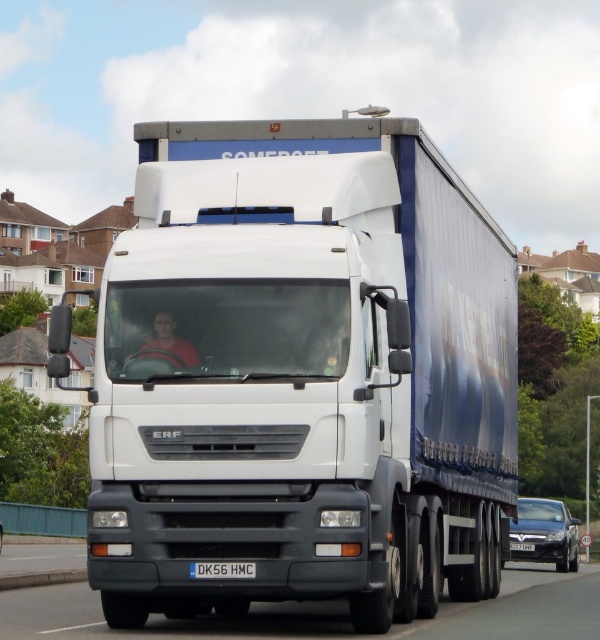
Who is positioned more to the right, white matte truck at center or black plastic license plate at center?

Positioned to the right is white matte truck at center.

What do you see at coordinates (303, 376) in the screenshot?
I see `white matte truck at center` at bounding box center [303, 376].

I want to click on white matte truck at center, so click(303, 376).

Where is `white matte truck at center`? The width and height of the screenshot is (600, 640). white matte truck at center is located at coordinates (303, 376).

Does white matte truck at center appear under white plastic license plate at center?

No.

Does white matte truck at center have a larger size compared to white plastic license plate at center?

Correct, white matte truck at center is larger in size than white plastic license plate at center.

Is point (322, 544) behind point (525, 547)?

No, it is in front of (525, 547).

The width and height of the screenshot is (600, 640). I want to click on white matte truck at center, so tap(303, 376).

Which is below, black rubber highway at center or white plastic license plate at center?

white plastic license plate at center is lower down.

Who is taller, black rubber highway at center or white plastic license plate at center?

black rubber highway at center

Describe the element at coordinates (160, 618) in the screenshot. I see `black rubber highway at center` at that location.

At what (x,y) coordinates should I click in order to perform the action: click on black rubber highway at center. Please return your answer as a coordinate pair (x, y). This screenshot has height=640, width=600. Looking at the image, I should click on (160, 618).